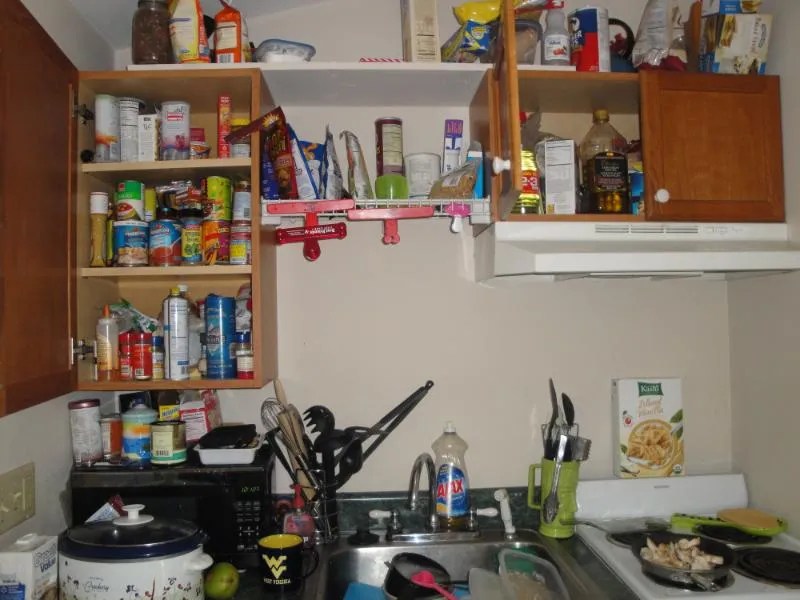
The height and width of the screenshot is (600, 800). I want to click on stovetop, so click(x=737, y=580).